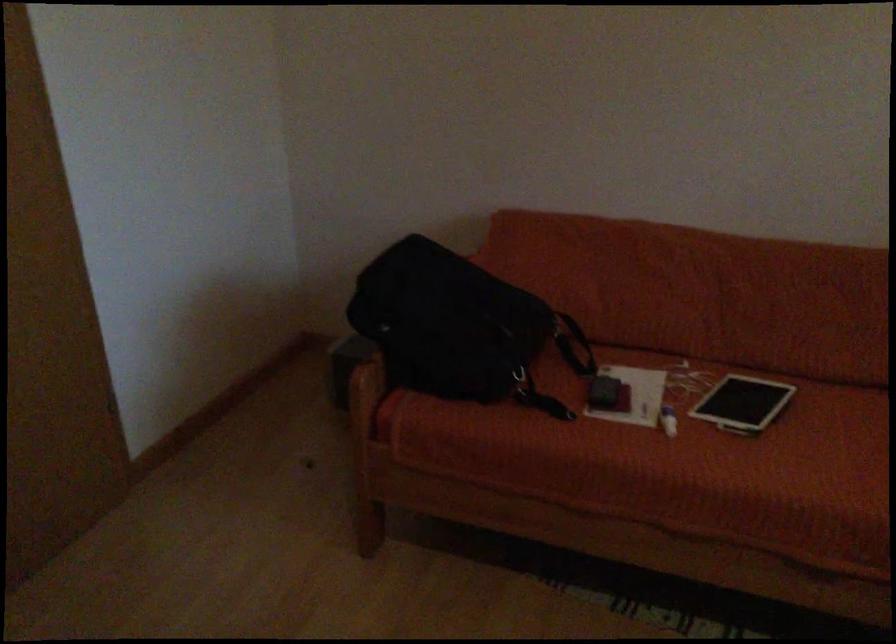
I want to click on sofa armrest, so click(x=366, y=386).